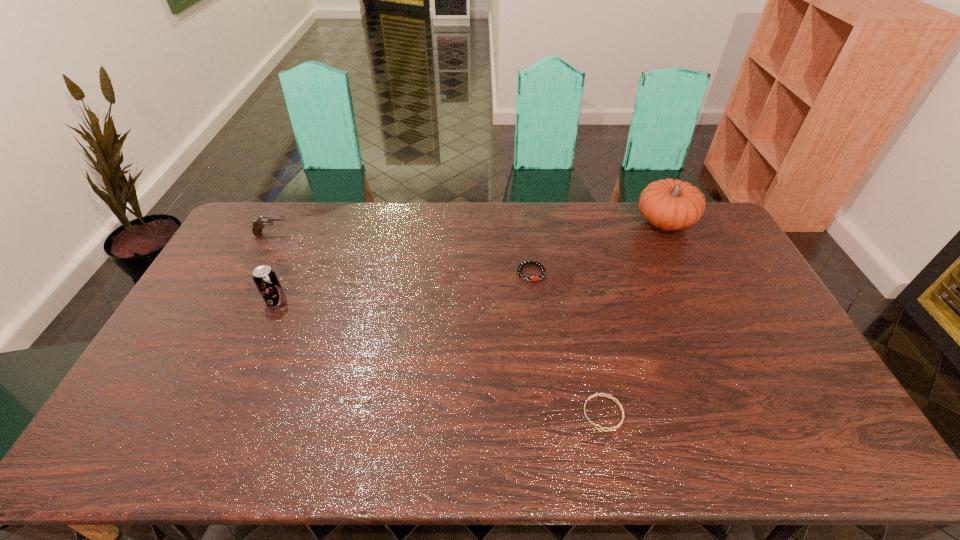
Locate an element on the screen. vacant space that is in between the third tallest object and the nearest object is located at coordinates (438, 323).

At what (x,y) coordinates should I click in order to perform the action: click on vacant point located between the right bracelet and the pistol. Please return your answer as a coordinate pair (x, y). Looking at the image, I should click on (438, 323).

You are a GUI agent. You are given a task and a screenshot of the screen. Output one action in this format:
    pyautogui.click(x=<x>, y=<y>)
    Task: Click on the free spot between the farther bracelet and the right bracelet
    
    Given the screenshot: What is the action you would take?
    pyautogui.click(x=567, y=343)

Identify the location of free space between the fourth shortest object and the third object from left to right. This screenshot has width=960, height=540. (403, 287).

Where is `free spot between the nearer bracelet and the farther bracelet`? free spot between the nearer bracelet and the farther bracelet is located at coordinates (567, 343).

Identify the location of free space between the third tallest object and the pumpkin. (468, 228).

The height and width of the screenshot is (540, 960). I want to click on free point between the second tallest object and the left bracelet, so click(403, 287).

The image size is (960, 540). Identify the location of object that stands as the closest to the right bracelet. (528, 262).

Identify which object is located as the second nearest to the nearer bracelet. Please provide its 2D coordinates. Your answer should be formatted as a tuple, i.e. [(x, y)], where the tuple contains the x and y coordinates of a point satisfying the conditions above.

[(669, 204)]

You are a GUI agent. You are given a task and a screenshot of the screen. Output one action in this format:
    pyautogui.click(x=<x>, y=<y>)
    Task: Click on the vacant area in the image that satisfies the following two spatial constraints: 1. at the barrel of the second tallest object; 2. on the right side of the leftmost object
    This screenshot has width=960, height=540.
    Given the screenshot: What is the action you would take?
    pyautogui.click(x=237, y=301)